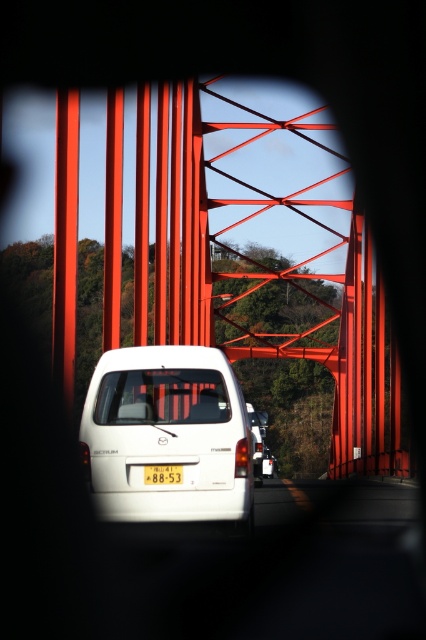
Question: Does metallic red bridge at center have a larger size compared to white matte van at center?

Choices:
 (A) no
 (B) yes

Answer: (B)

Question: Can you confirm if metallic red bridge at center is positioned above yellow plastic license plate at center?

Choices:
 (A) no
 (B) yes

Answer: (B)

Question: Which object is the farthest from the white matte van at center?

Choices:
 (A) yellow plastic license plate at center
 (B) metallic red bridge at center

Answer: (B)

Question: Which is nearer to the white matte van at center?

Choices:
 (A) metallic red bridge at center
 (B) yellow plastic license plate at center

Answer: (B)

Question: From the image, what is the correct spatial relationship of white matte van at center in relation to yellow plastic license plate at center?

Choices:
 (A) below
 (B) above

Answer: (B)

Question: Which point is closer to the camera?

Choices:
 (A) (138, 372)
 (B) (164, 470)

Answer: (B)